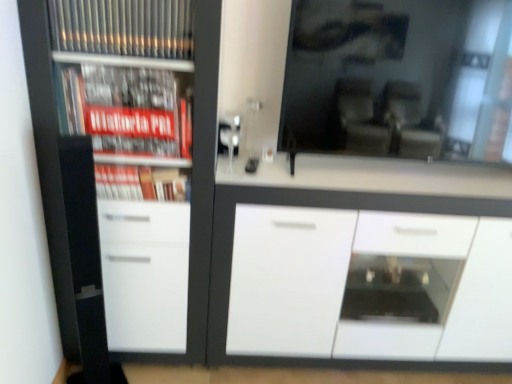
Question: Considering the relative sizes of white glossy cupboard at left and white glossy cabinet at center in the image provided, is white glossy cupboard at left bigger than white glossy cabinet at center?

Choices:
 (A) yes
 (B) no

Answer: (B)

Question: Does white glossy cupboard at left have a greater height compared to white glossy cabinet at center?

Choices:
 (A) yes
 (B) no

Answer: (A)

Question: Would you consider white glossy cupboard at left to be distant from white glossy cabinet at center?

Choices:
 (A) no
 (B) yes

Answer: (A)

Question: Could you tell me if white glossy cupboard at left is facing white glossy cabinet at center?

Choices:
 (A) yes
 (B) no

Answer: (B)

Question: Is white glossy cupboard at left outside white glossy cabinet at center?

Choices:
 (A) yes
 (B) no

Answer: (A)

Question: From a real-world perspective, is white glossy cupboard at left positioned over white glossy cabinet at center based on gravity?

Choices:
 (A) yes
 (B) no

Answer: (A)

Question: From a real-world perspective, is white glossy cupboard at left on transparent glass mirror at upper center?

Choices:
 (A) yes
 (B) no

Answer: (B)

Question: Is white glossy cupboard at left oriented towards transparent glass mirror at upper center?

Choices:
 (A) yes
 (B) no

Answer: (B)

Question: Could transparent glass mirror at upper center be considered to be inside white glossy cupboard at left?

Choices:
 (A) yes
 (B) no

Answer: (B)

Question: Can you confirm if white glossy cupboard at left is wider than transparent glass mirror at upper center?

Choices:
 (A) no
 (B) yes

Answer: (B)

Question: Is there a large distance between white glossy cupboard at left and transparent glass mirror at upper center?

Choices:
 (A) no
 (B) yes

Answer: (A)

Question: Considering the relative sizes of white glossy cupboard at left and transparent glass mirror at upper center in the image provided, is white glossy cupboard at left taller than transparent glass mirror at upper center?

Choices:
 (A) no
 (B) yes

Answer: (B)

Question: Is white glossy cabinet at center at the right side of white glossy cupboard at left?

Choices:
 (A) yes
 (B) no

Answer: (A)